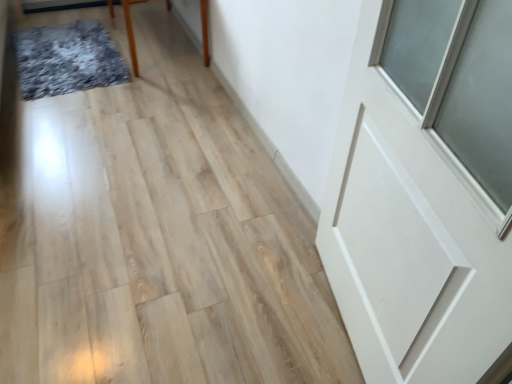
Locate an element on the screen. free point below textured gray mat at upper left (from a real-world perspective) is located at coordinates (60, 54).